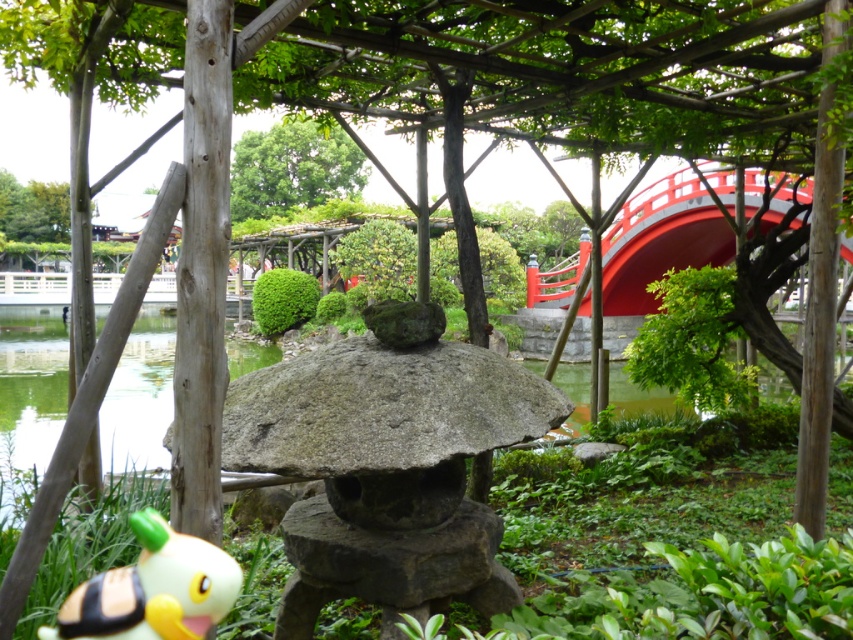
Question: Is green mossy water at lower left positioned before bee plush at lower left?

Choices:
 (A) yes
 (B) no

Answer: (B)

Question: Which object appears closest to the camera in this image?

Choices:
 (A) green mossy water at lower left
 (B) green leafy tree at upper center

Answer: (A)

Question: Can you confirm if green mossy water at lower left is wider than bee plush at lower left?

Choices:
 (A) yes
 (B) no

Answer: (A)

Question: Which object is closer to the camera taking this photo?

Choices:
 (A) green mossy water at lower left
 (B) gray stone lantern at center
 (C) green leafy tree at upper center

Answer: (B)

Question: Which of these objects is positioned farthest from the green mossy water at lower left?

Choices:
 (A) bee plush at lower left
 (B) green leafy tree at upper center

Answer: (A)

Question: Does green mossy water at lower left have a lesser width compared to green leafy tree at upper center?

Choices:
 (A) yes
 (B) no

Answer: (B)